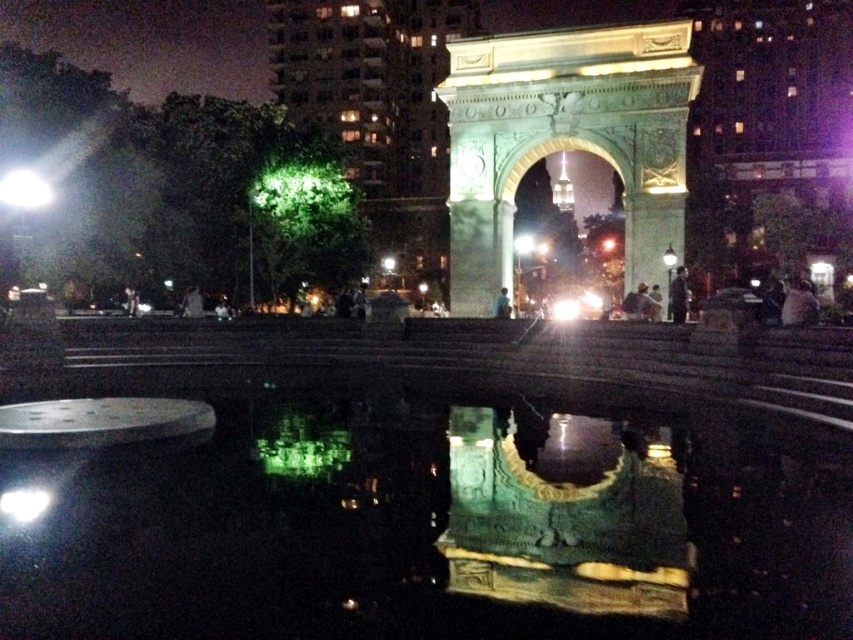
Does green reflective water at center have a greater height compared to green stone arch at center?

No.

Does green reflective water at center appear on the left side of green stone arch at center?

Correct, you'll find green reflective water at center to the left of green stone arch at center.

The image size is (853, 640). Describe the element at coordinates (437, 525) in the screenshot. I see `green reflective water at center` at that location.

You are a GUI agent. You are given a task and a screenshot of the screen. Output one action in this format:
    pyautogui.click(x=<x>, y=<y>)
    Task: Click on the green reflective water at center
    
    Given the screenshot: What is the action you would take?
    pyautogui.click(x=437, y=525)